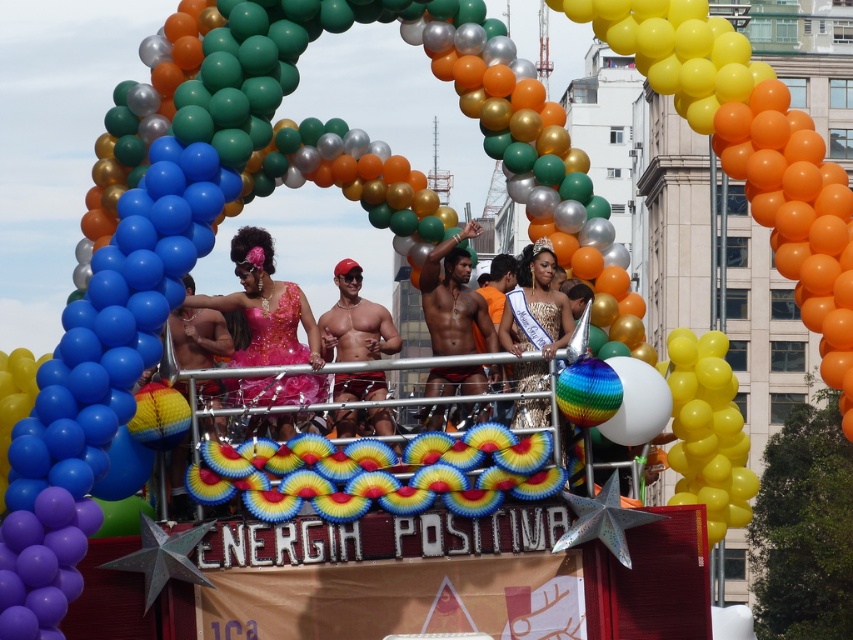
You are a photographer at the parade and want to capture both the sparkly pink dress at center and the gold sequined dress at center in a single frame. Which dress should you focus on to ensure both are visible without zooming in or out?

You should focus on the sparkly pink dress at center because it is bigger than the gold sequined dress at center, making it easier to frame both without adjusting the zoom.

You are a photographer at the parade and want to capture both the sparkly pink dress at center and the shiny metallic shorts at center in a single frame. Which object should you focus on first to ensure both are in the shot?

The sparkly pink dress at center is bigger than the shiny metallic shorts at center, so you should focus on the sparkly pink dress at center first to ensure both are in the shot.

You are a photographer trying to capture a clear shot of both the shiny metallic shorts at center and the shiny red shorts at center on the parade float. Since you want to ensure both are visible in your photo, which pair of shorts should you focus on first to make sure they are in frame?

The shiny metallic shorts at center is taller than the shiny red shorts at center, so you should focus on positioning the taller shiny metallic shorts at center first to ensure it doesn